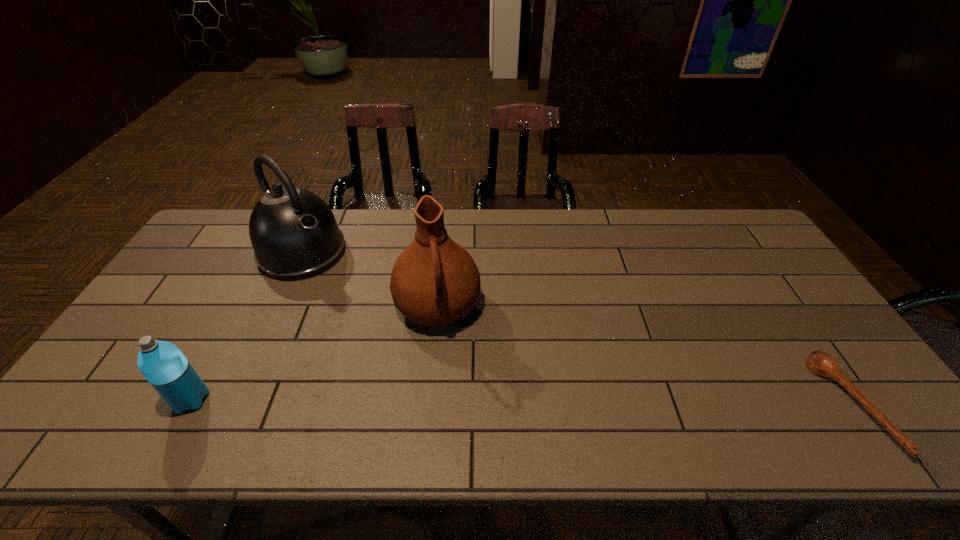
At what (x,y) coordinates should I click in order to perform the action: click on free space located 0.340m on the spout of the kettle. Please return your answer as a coordinate pair (x, y). Looking at the image, I should click on (394, 332).

Where is `vacant area situated on the spout of the kettle`? The image size is (960, 540). vacant area situated on the spout of the kettle is located at coordinates (335, 281).

Find the location of a particular element. The height and width of the screenshot is (540, 960). object located at the far edge is located at coordinates (294, 234).

Where is `thermos bottle that is at the near edge`? Image resolution: width=960 pixels, height=540 pixels. thermos bottle that is at the near edge is located at coordinates (165, 367).

The image size is (960, 540). I want to click on wooden spoon located at the near edge, so click(819, 363).

The height and width of the screenshot is (540, 960). What are the coordinates of `object located in the right edge section of the desktop` in the screenshot? It's located at (819, 363).

At what (x,y) coordinates should I click in order to perform the action: click on object positioned at the near right corner. Please return your answer as a coordinate pair (x, y). Looking at the image, I should click on (819, 363).

Image resolution: width=960 pixels, height=540 pixels. Find the location of `free space at the far edge of the desktop`. free space at the far edge of the desktop is located at coordinates (644, 247).

The image size is (960, 540). I want to click on vacant space at the near edge of the desktop, so click(x=651, y=406).

The height and width of the screenshot is (540, 960). Identify the location of vacant space at the left edge. (180, 316).